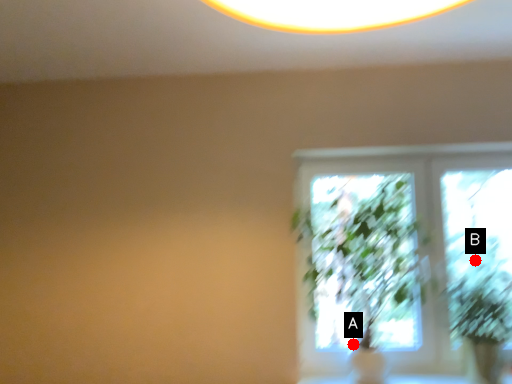
Question: Two points are circled on the image, labeled by A and B beside each circle. Among these points, which one is nearest to the camera?

Choices:
 (A) A is closer
 (B) B is closer

Answer: (B)